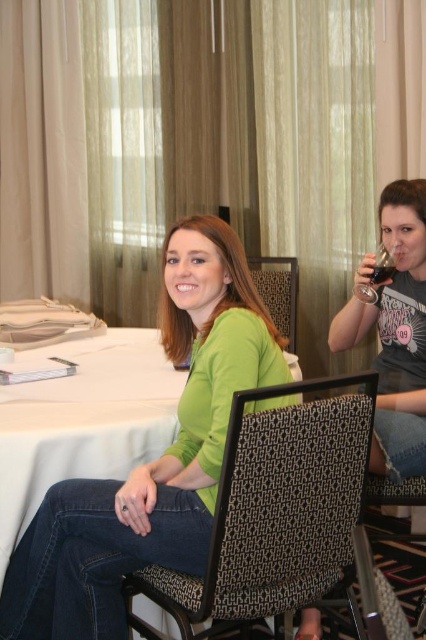
Can you confirm if white fabric table at center is taller than translucent glass wine glass at upper right?

Indeed, white fabric table at center has a greater height compared to translucent glass wine glass at upper right.

Does white fabric table at center appear on the right side of translucent glass wine glass at upper right?

No, white fabric table at center is not to the right of translucent glass wine glass at upper right.

Who is more forward, (x=91, y=403) or (x=386, y=273)?

Point (x=91, y=403) is more forward.

Where is `white fabric table at center`? white fabric table at center is located at coordinates (83, 420).

Is matte black shirt at right above translucent glass at upper right?

Incorrect, matte black shirt at right is not positioned above translucent glass at upper right.

Who is more distant from viewer, (416, 392) or (382, 268)?

The point (382, 268) is more distant.

Locate an element on the screen. This screenshot has height=640, width=426. matte black shirt at right is located at coordinates (394, 332).

Can you confirm if translucent glass wine glass at upper right is positioned to the right of translucent glass at upper right?

Correct, you'll find translucent glass wine glass at upper right to the right of translucent glass at upper right.

Does point (373, 276) come closer to viewer compared to point (376, 280)?

Yes, point (373, 276) is closer to viewer.

At what (x,y) coordinates should I click in order to perform the action: click on translucent glass wine glass at upper right. Please return your answer as a coordinate pair (x, y). The height and width of the screenshot is (640, 426). Looking at the image, I should click on (376, 275).

Where is `translucent glass wine glass at upper right`? This screenshot has height=640, width=426. translucent glass wine glass at upper right is located at coordinates click(376, 275).